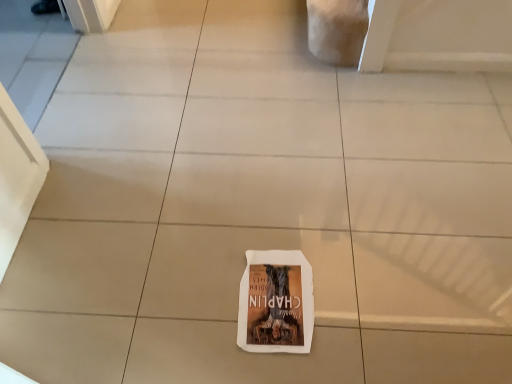
In order to click on vacant space to the left of white paper flyer at center in this screenshot , I will do `click(194, 296)`.